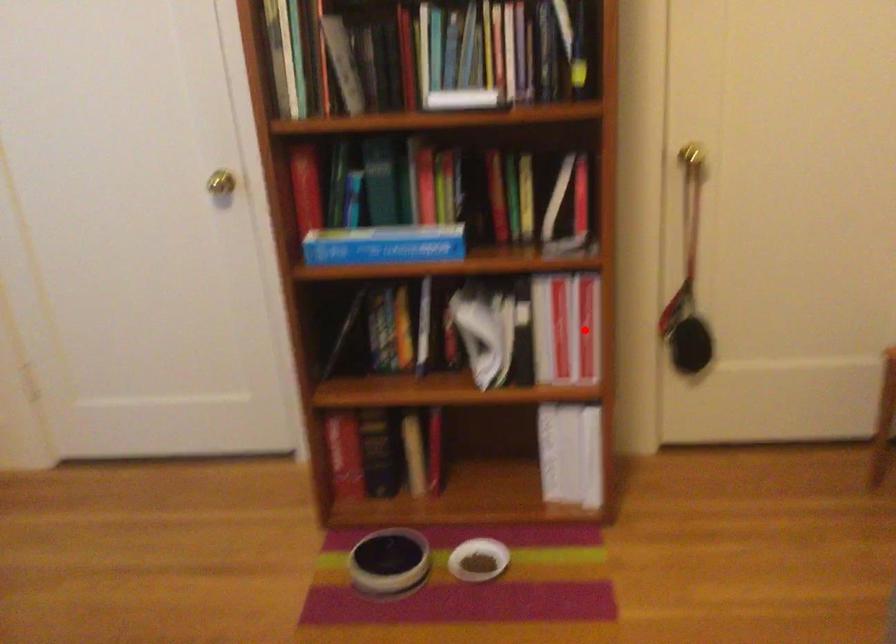
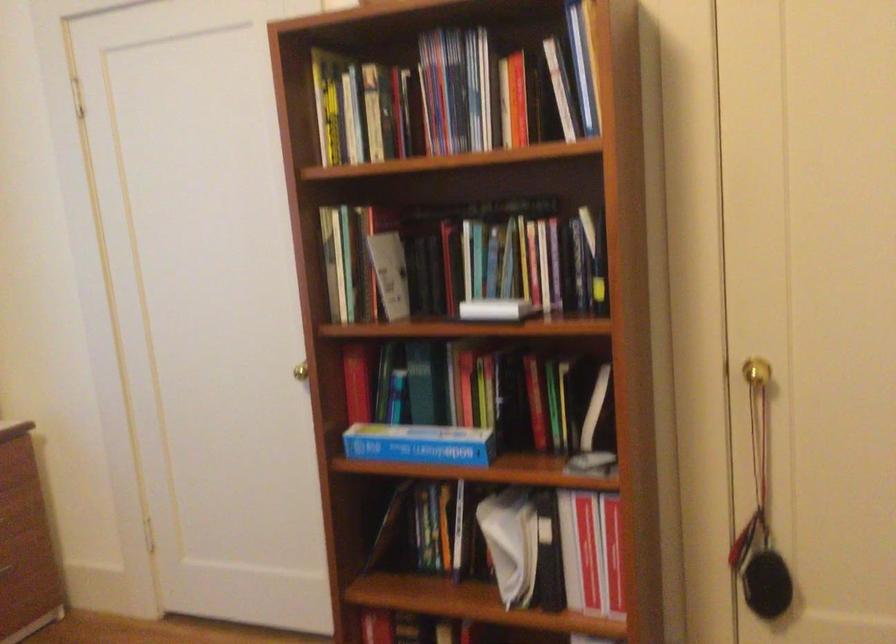
Question: I am providing you with two images of the same scene from different viewpoints. A red point is marked on the first image. Is the red point's position out of view in image 2?

Choices:
 (A) Yes
 (B) No

Answer: (B)